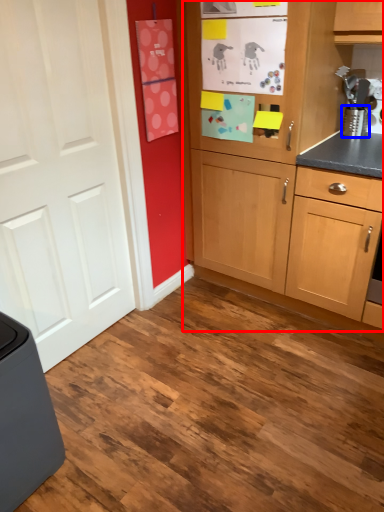
Question: Which point is closer to the camera, cabinetry (highlighted by a red box) or appliance (highlighted by a blue box)?

Choices:
 (A) cabinetry
 (B) appliance

Answer: (A)